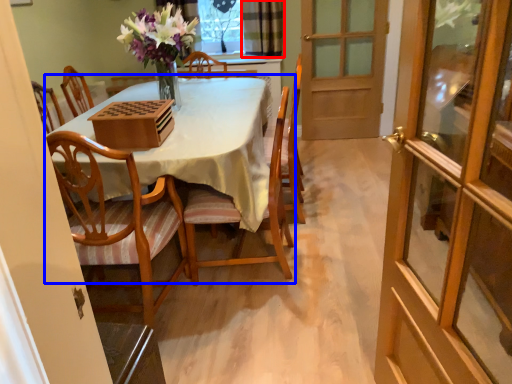
Question: Among these objects, which one is nearest to the camera, curtain (highlighted by a red box) or kitchen & dining room table (highlighted by a blue box)?

Choices:
 (A) curtain
 (B) kitchen & dining room table

Answer: (B)